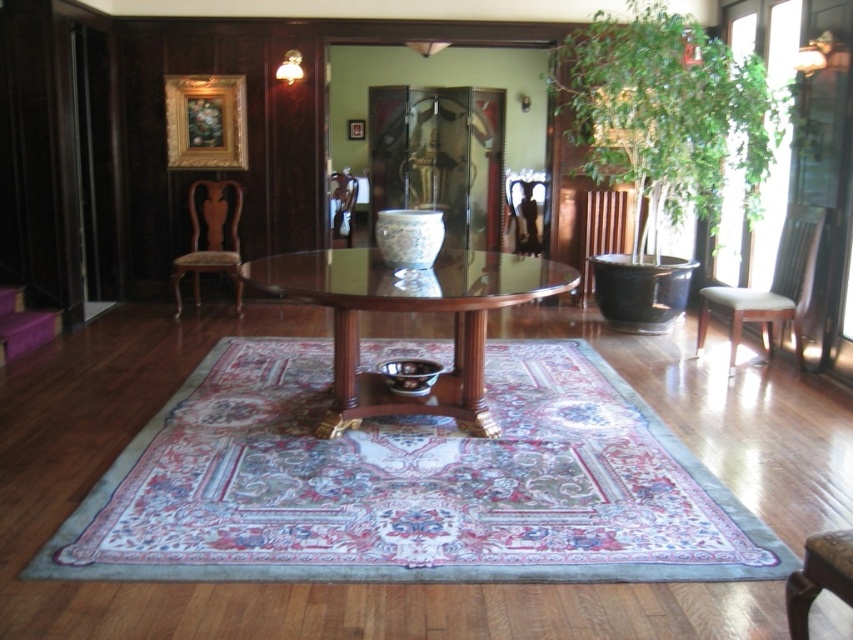
You are standing in the dining room and want to place a new decorative item on the table. The item requires a space that is at least 3 meters away from the viewer to ensure visibility. Is the point at point coordinates point (764, 292) suitable for placing the item?

The distance of point (764, 292) from viewer is 4.62 meters, which is more than the required 3 meters. Therefore, placing the item at point (764, 292) will ensure it is visible.

You are a guest at a dinner party in the dining room and want to sit down. You see the green leafy plant at upper right and the black wood chair at right. Which object is positioned to the right of the other?

The green leafy plant at upper right is to the right of the black wood chair at right.